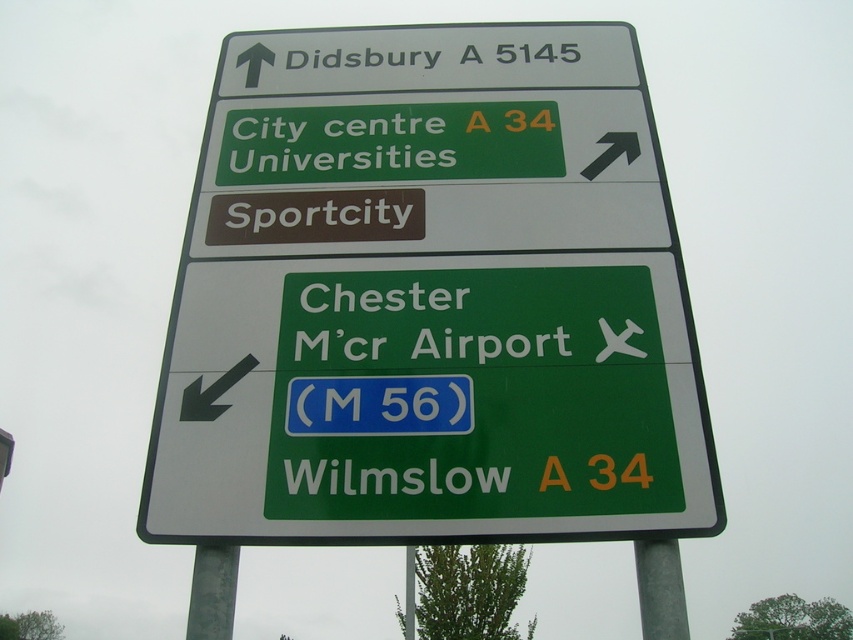
What is the color of the sign that is located at the point with coordinates (430, 300)?

The point at coordinates (430, 300) indicates a green plastic sign at upper center.

Based on the photo, you are standing in front of the road signboard and notice two poles supporting it. The poles are labeled as the gray metallic pole at lower right and the metallic gray pole at lower center. Which pole is larger in size?

The gray metallic pole at lower right is bigger than the metallic gray pole at lower center.